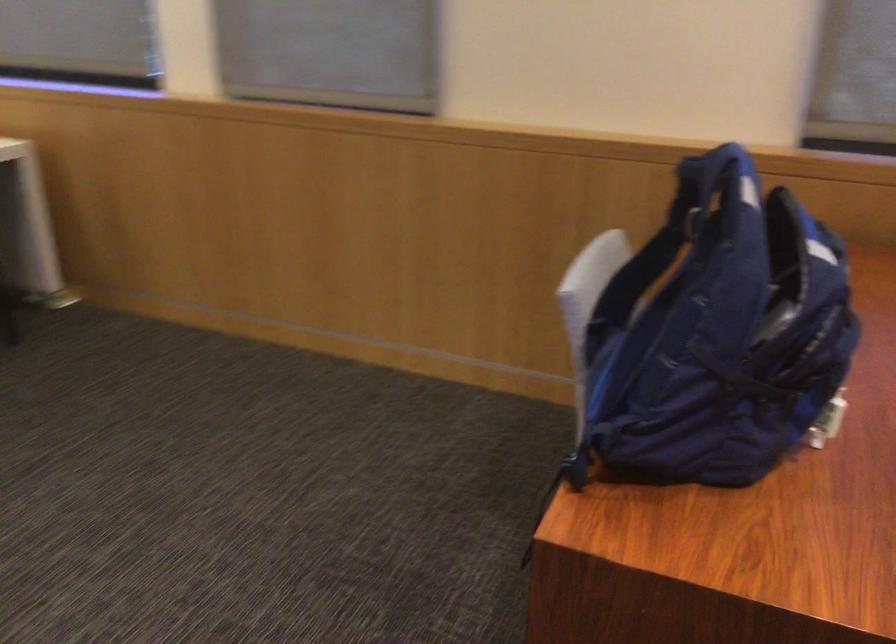
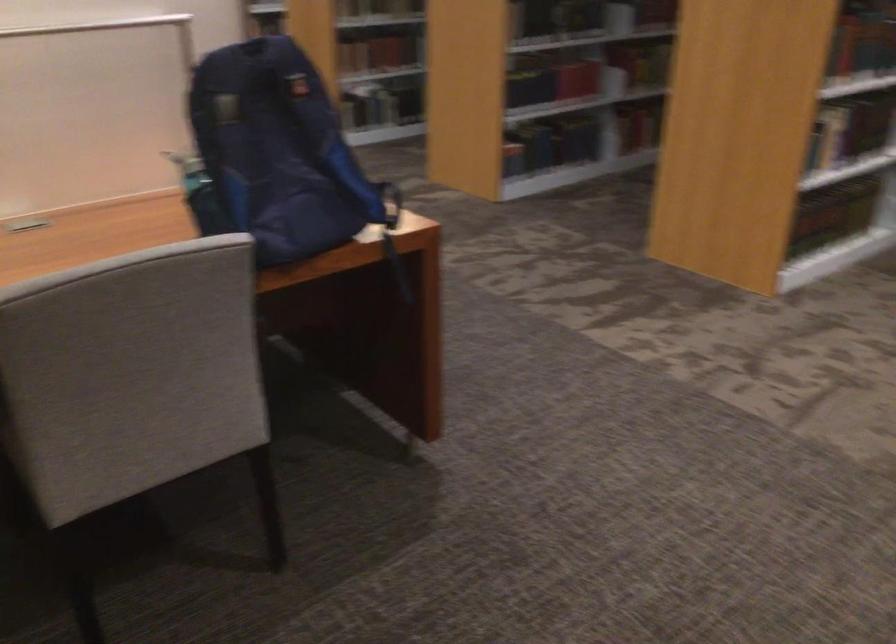
Find the pixel in the second image that matches point (590, 512) in the first image.

(392, 234)